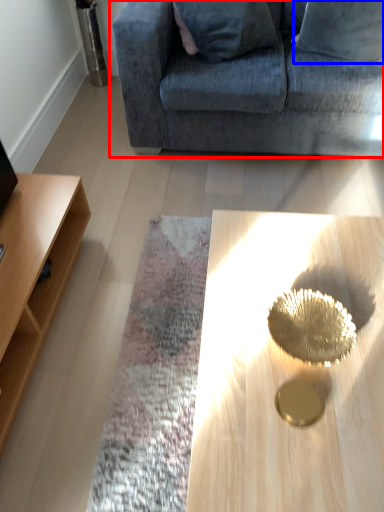
Question: Among these objects, which one is nearest to the camera, studio couch (highlighted by a red box) or pillow (highlighted by a blue box)?

Choices:
 (A) studio couch
 (B) pillow

Answer: (A)